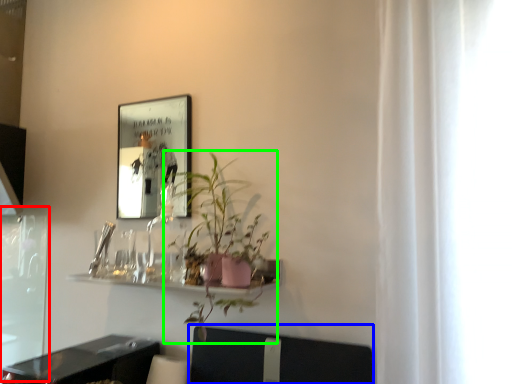
Question: Based on their relative distances, which object is farther from screen door (highlighted by a red box)? Choose from swivel chair (highlighted by a blue box) and houseplant (highlighted by a green box).

Choices:
 (A) swivel chair
 (B) houseplant

Answer: (A)